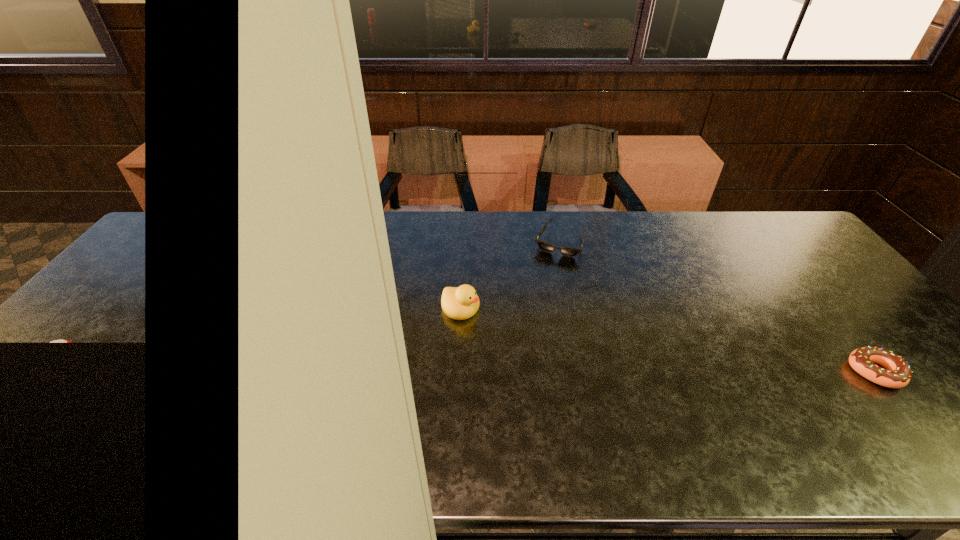
Locate an element on the screen. doughnut is located at coordinates point(897,373).

Locate an element on the screen. the rightmost object is located at coordinates (897, 373).

Find the location of `the second object from left to right`. the second object from left to right is located at coordinates (544, 246).

In order to click on sunglasses in this screenshot , I will do `click(544, 246)`.

Locate an element on the screen. This screenshot has height=540, width=960. the leftmost object is located at coordinates (459, 303).

Identify the location of the tallest object. Image resolution: width=960 pixels, height=540 pixels. (459, 303).

Find the location of a particular element. free space located on the back of the doughnut is located at coordinates (845, 336).

Where is `blank space located 0.090m on the front-facing side of the farthest object`? Image resolution: width=960 pixels, height=540 pixels. blank space located 0.090m on the front-facing side of the farthest object is located at coordinates [547, 277].

At what (x,y) coordinates should I click in order to perform the action: click on vacant space located 0.220m on the front-facing side of the farthest object. Please return your answer as a coordinate pair (x, y). This screenshot has height=540, width=960. Looking at the image, I should click on (536, 305).

Where is `vacant space located 0.270m on the front-facing side of the farthest object`? This screenshot has width=960, height=540. vacant space located 0.270m on the front-facing side of the farthest object is located at coordinates (531, 317).